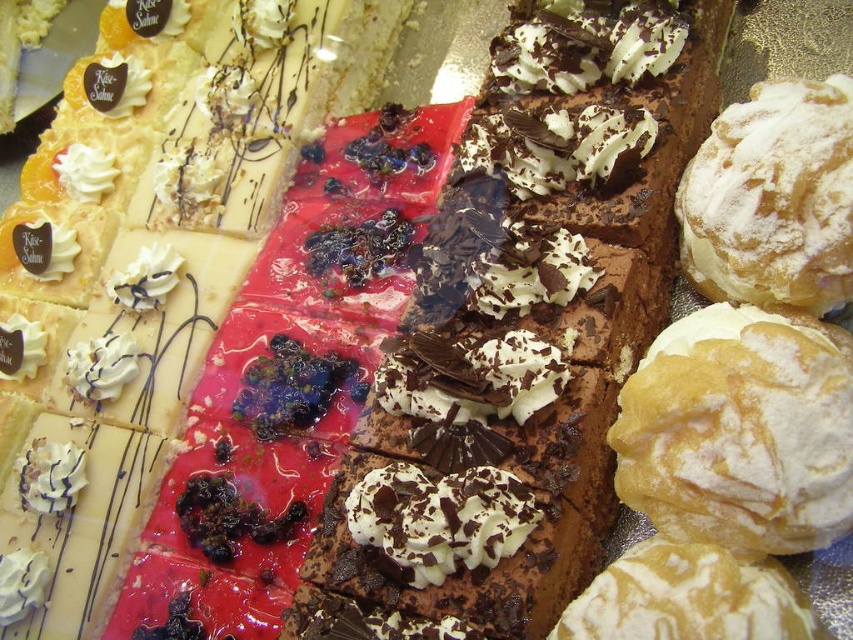
Who is higher up, powdered yellow puff pastry at center right or whipped cream at center?

Positioned higher is powdered yellow puff pastry at center right.

Is powdered yellow puff pastry at center right smaller than whipped cream at center?

Actually, powdered yellow puff pastry at center right might be larger than whipped cream at center.

The image size is (853, 640). In order to click on powdered yellow puff pastry at center right in this screenshot , I will do `click(740, 432)`.

Is powdered yellow puff pastry at center right to the left of powdered sugar puff at upper right from the viewer's perspective?

Yes, powdered yellow puff pastry at center right is to the left of powdered sugar puff at upper right.

Who is more distant from viewer, (718, 326) or (837, 211)?

Positioned behind is point (718, 326).

Where is `powdered yellow puff pastry at center right`? powdered yellow puff pastry at center right is located at coordinates (740, 432).

Is powdered white cream puff at center right positioned before whipped cream at center?

Yes, powdered white cream puff at center right is closer to the viewer.

Who is positioned more to the right, powdered white cream puff at center right or whipped cream at center?

From the viewer's perspective, powdered white cream puff at center right appears more on the right side.

Which is in front, point (796, 611) or point (456, 508)?

Point (796, 611) is in front.

In order to click on powdered white cream puff at center right in this screenshot , I will do `click(688, 596)`.